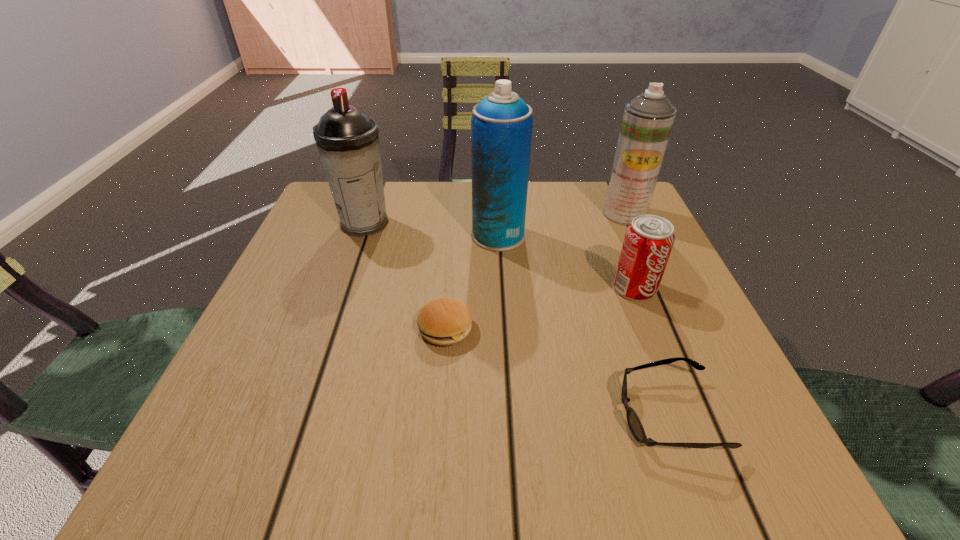
The height and width of the screenshot is (540, 960). In order to click on vacant space located 0.360m on the left of the soda can in this screenshot , I will do `click(423, 288)`.

Where is `free point located on the right of the second nearest object`? The height and width of the screenshot is (540, 960). free point located on the right of the second nearest object is located at coordinates (507, 328).

Find the location of `vacant space located on the lenses of the nearest object`. vacant space located on the lenses of the nearest object is located at coordinates (489, 415).

The width and height of the screenshot is (960, 540). What are the coordinates of `free region located on the lenses of the nearest object` in the screenshot? It's located at (579, 415).

At what (x,y) coordinates should I click in order to perform the action: click on free space located 0.060m on the lenses of the nearest object. Please return your answer as a coordinate pair (x, y). The height and width of the screenshot is (540, 960). Looking at the image, I should click on (579, 415).

The width and height of the screenshot is (960, 540). I want to click on object that is positioned at the near edge, so click(x=634, y=423).

Locate an element on the screen. This screenshot has height=540, width=960. object present at the left edge is located at coordinates (347, 139).

Locate an element on the screen. aerosol can that is at the right edge is located at coordinates (647, 121).

At what (x,y) coordinates should I click in order to perform the action: click on soda can that is at the right edge. Please return your answer as a coordinate pair (x, y). The width and height of the screenshot is (960, 540). Looking at the image, I should click on (649, 239).

Identify the location of sunglasses that is at the right edge. (634, 423).